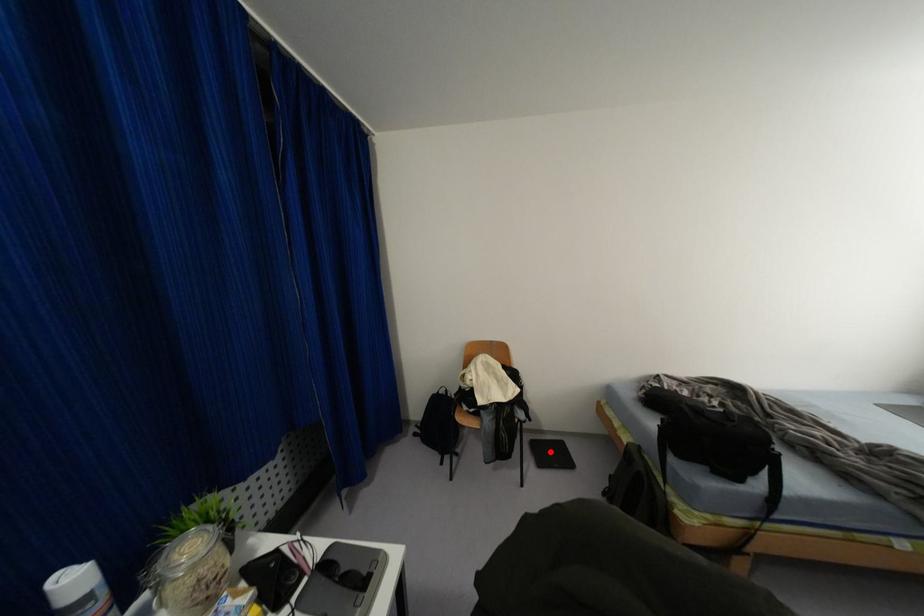
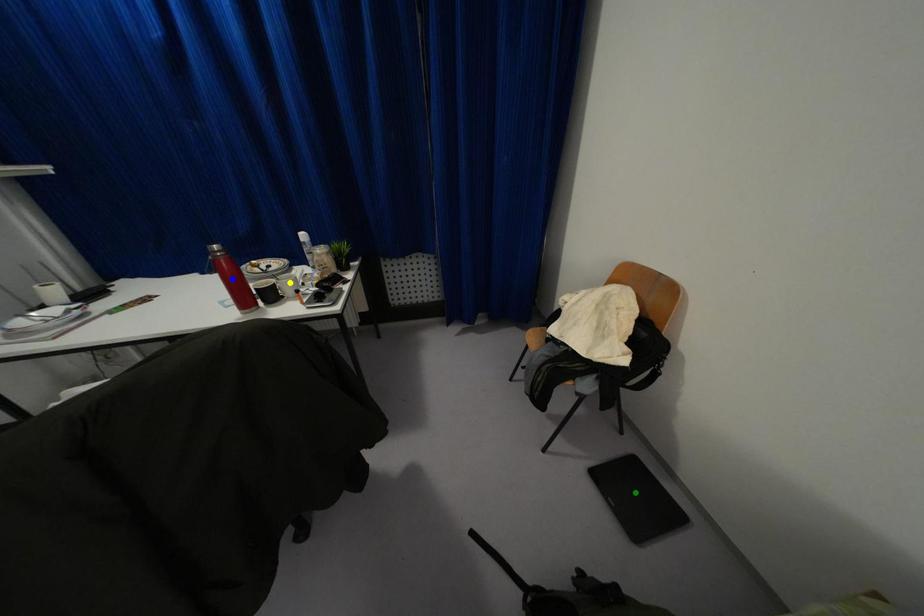
Question: I am providing you with two images of the same scene from different viewpoints. A red point is marked on the first image. You are given multiple points on the second image. Which point in image 2 represents the same 3d spot as the red point in image 1?

Choices:
 (A) green point
 (B) blue point
 (C) yellow point

Answer: (A)